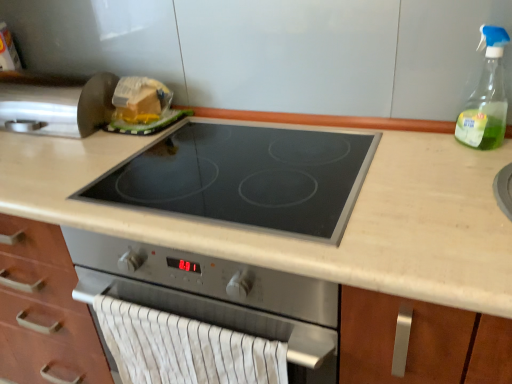
At what (x,y) coordinates should I click in order to perform the action: click on free space in front of translucent plastic cheese at upper left. Please return your answer as a coordinate pair (x, y). Looking at the image, I should click on (124, 144).